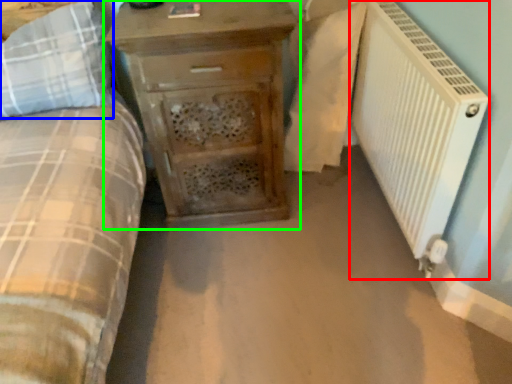
Question: Which object is positioned closest to radiator (highlighted by a red box)? Select from pillow (highlighted by a blue box) and chest of drawers (highlighted by a green box).

Choices:
 (A) pillow
 (B) chest of drawers

Answer: (B)